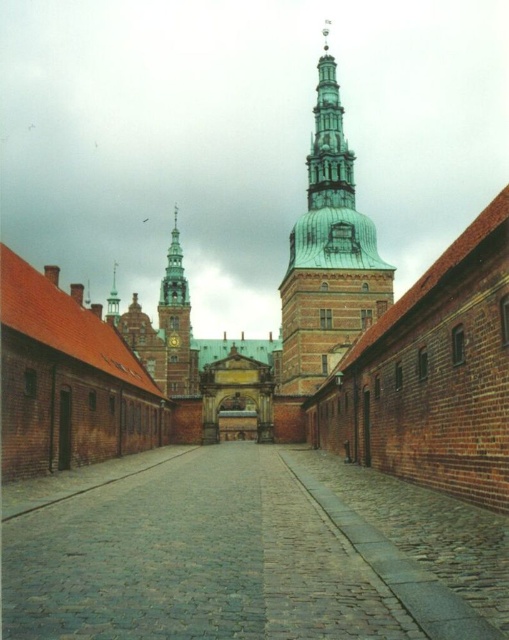
You are an architect visiting the historic site and want to compare the height of the cobblestone alley at center and the green copper spire at upper center. Which one is taller?

The green copper spire at upper center is taller than the cobblestone alley at center.